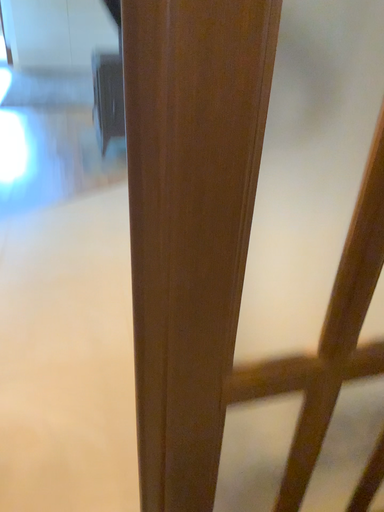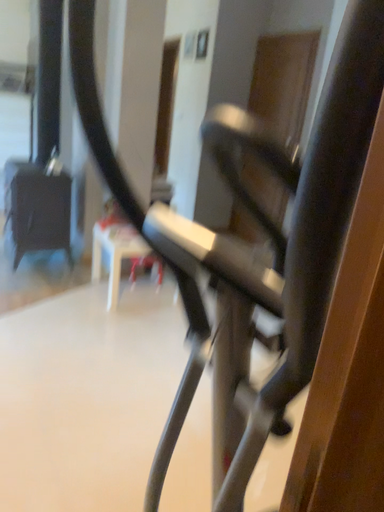
Question: Which way did the camera rotate in the video?

Choices:
 (A) rotated downward
 (B) rotated upward

Answer: (B)